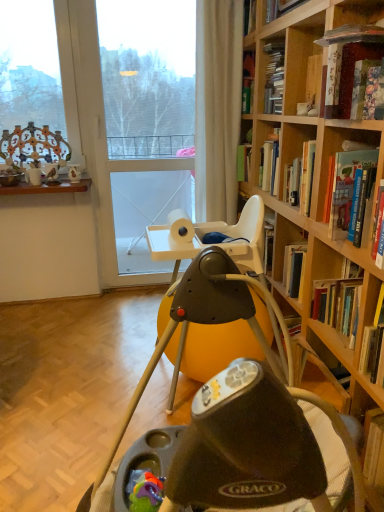
Question: Is point (352, 161) closer or farther from the camera than point (165, 436)?

Choices:
 (A) farther
 (B) closer

Answer: (A)

Question: Is hardcover book at upper right, which is the 3th book in top-to-bottom order, taller or shorter than matte black swing at center?

Choices:
 (A) tall
 (B) short

Answer: (B)

Question: Based on their relative distances, which object is farther from the hardcover book at upper right, the 1th book in the bottom-to-top sequence?

Choices:
 (A) matte black swing at center
 (B) matte glass window at upper left
 (C) rubberized plastic teether at lower center
 (D) matte white cup at upper left
 (E) hardcover book at upper right, the 1th book from the top

Answer: (B)

Question: Which is farther from the matte black swing at center?

Choices:
 (A) matte white cup at upper left
 (B) matte glass window at upper left
 (C) hardcover book at upper right, the second book in the top-to-bottom sequence
 (D) hardcover book at upper right, which is the 3th book in top-to-bottom order
 (E) transparent glass door at center

Answer: (E)